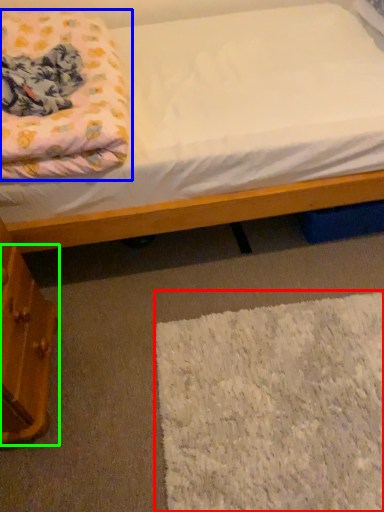
Question: Considering the real-world distances, which object is farthest from mat (highlighted by a red box)? blanket (highlighted by a blue box) or drawer (highlighted by a green box)?

Choices:
 (A) blanket
 (B) drawer

Answer: (A)